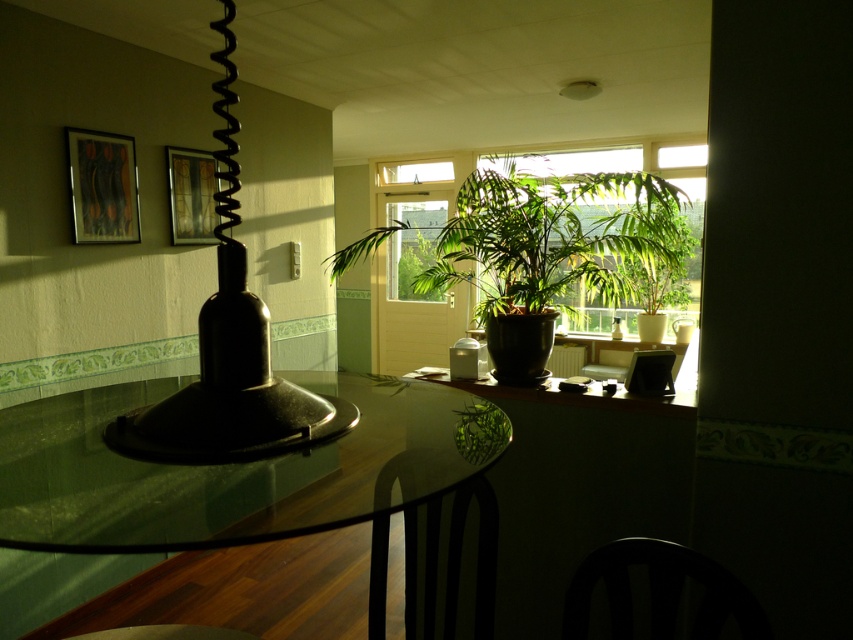
You are trying to place a decorative item on the transparent glass table at center and the green glossy plant at center. Which object has a smaller width to consider for placement?

The transparent glass table at center is thinner than the green glossy plant at center, so it has a smaller width and should be considered for placement accordingly.

You are a guest entering the dining area and need to sit down. You see the transparent glass table at center and the black wood chair at lower center. Which one is lower to the ground?

The transparent glass table at center has a lesser height compared to the black wood chair at lower center, so the transparent glass table at center is lower to the ground.

You are a guest entering the dining area and want to sit down at the transparent glass table at center. However, you notice a green glossy plant at center nearby. Which object is closer to you as you enter?

The transparent glass table at center is closer to you than the green glossy plant at center because it is in front of it.